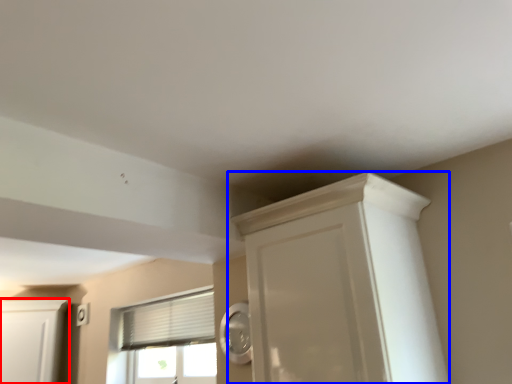
Question: Which object appears closest to the camera in this image, cabinetry (highlighted by a red box) or cupboard (highlighted by a blue box)?

Choices:
 (A) cabinetry
 (B) cupboard

Answer: (B)